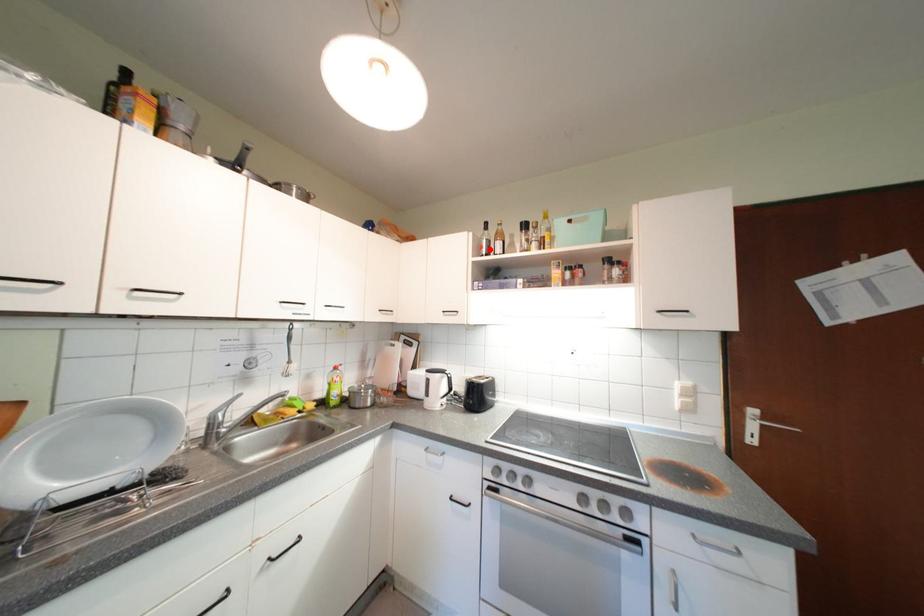
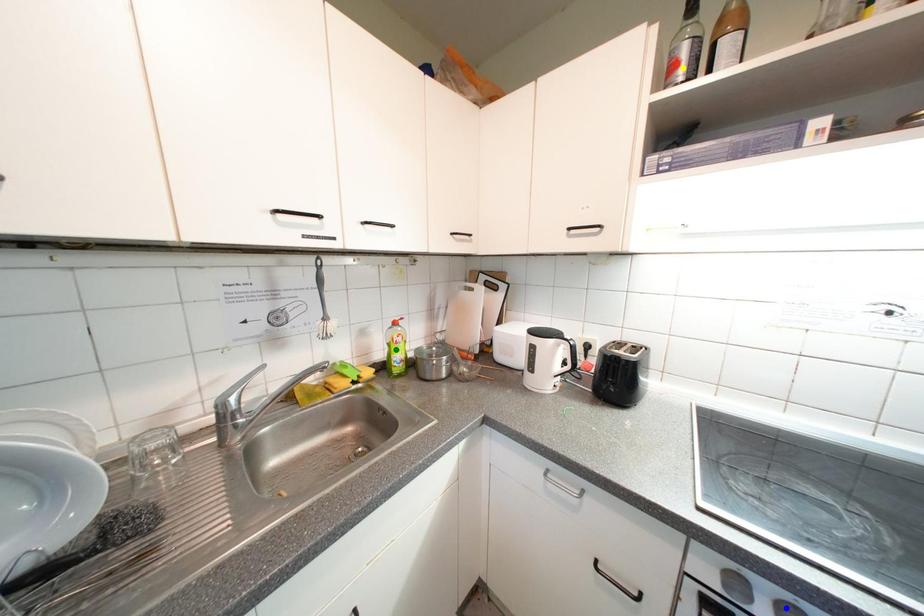
Question: I am providing you with two images of the same scene from different viewpoints. A red point is marked on the first image. You are given multiple points on the second image. Which point in image 2 is actually the same real-world point as the red point in image 1?

Choices:
 (A) yellow point
 (B) green point
 (C) blue point

Answer: (A)